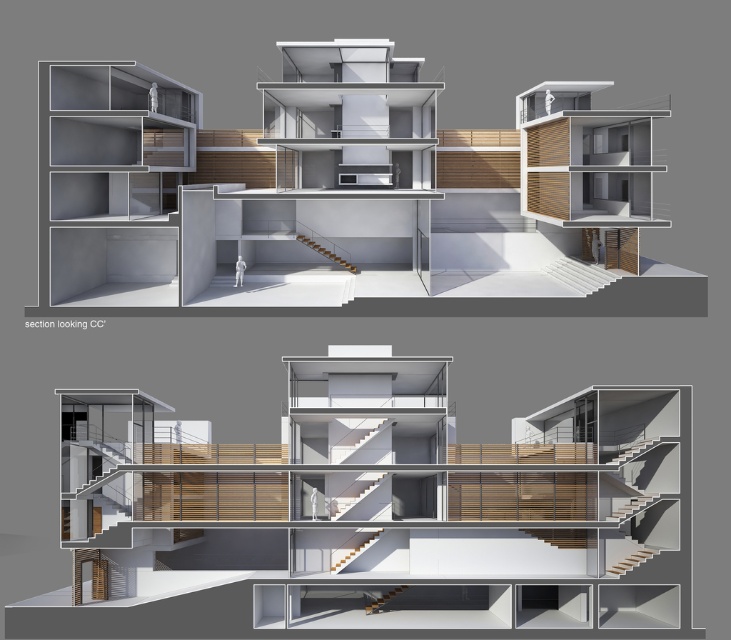
You are an architect reviewing the section drawing labeled CC. You need to determine which of the two points, point (594,282) or point (322,253), is closer to the viewer in this section view. Which one is it?

Point (594,282) is closer to the camera than point (322,253).

You are an architect reviewing the section drawing labeled CC. You need to determine the visibility of the wooden stairs at center. Are they visible from the front side of the white glossy stairs at center?

The white glossy stairs at center is in front of wooden stairs at center, so the wooden stairs at center are not visible from the front side of the white glossy stairs at center.